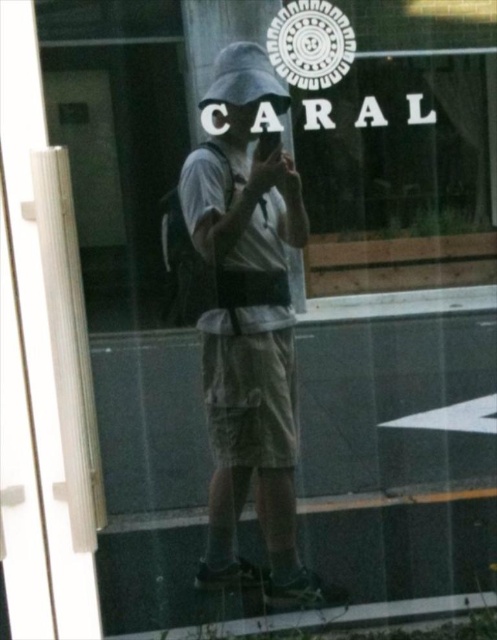
Where is the khaki cotton shorts at center located in the image?

The khaki cotton shorts at center is located at point (246,323) in the image.

You are a photographer analyzing the image. The point at coordinates (246,323) is marked on the khaki cotton shorts at center. If you want to focus your camera on this point, which object in the scene should you adjust your focus to?

The point at coordinates (246,323) is on the khaki cotton shorts at center, so you should adjust your focus to the khaki cotton shorts at center.